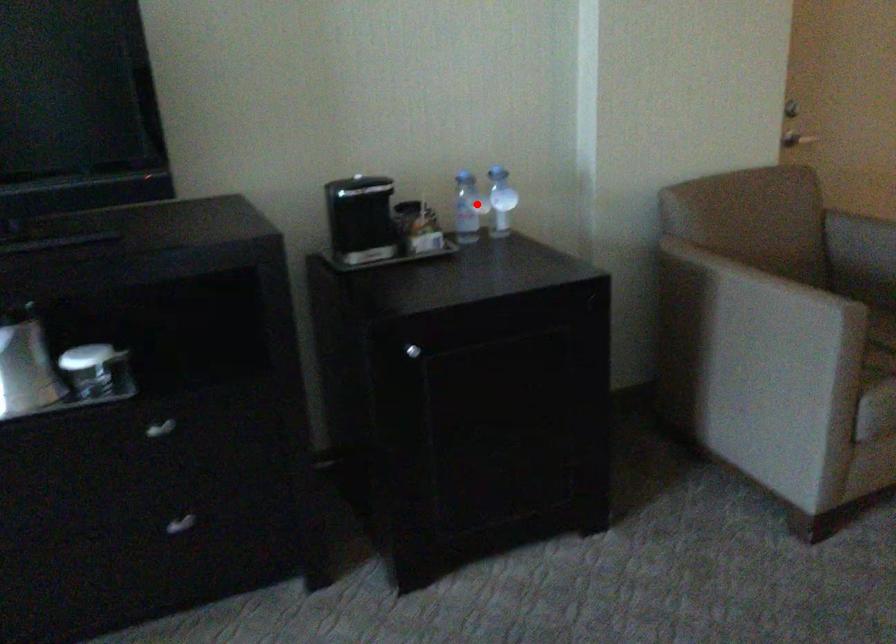
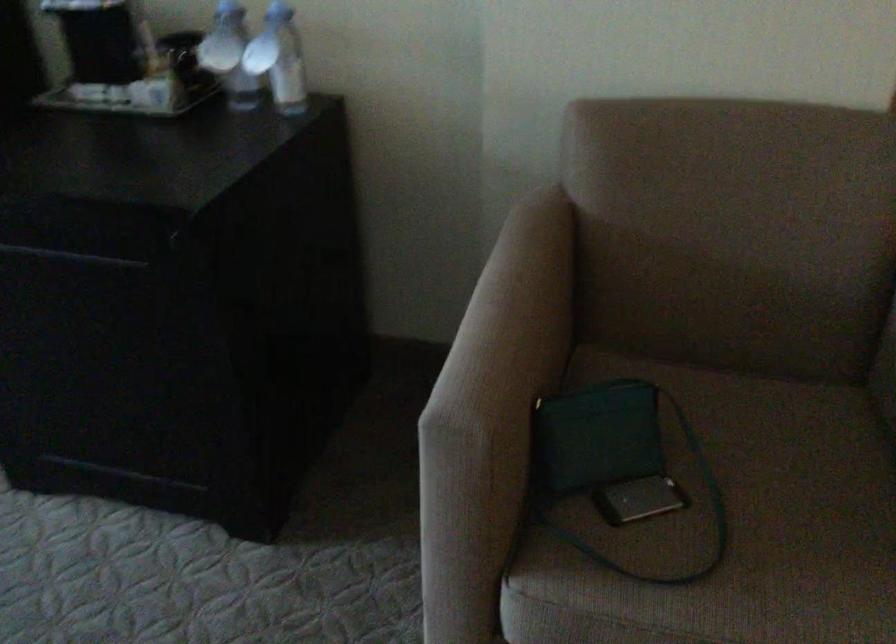
Question: I am providing you with two images of the same scene from different viewpoints. A red point is shown in image1. For the corresponding object point in image2, is it positioned nearer or farther from the camera?

Choices:
 (A) Nearer
 (B) Farther

Answer: (A)